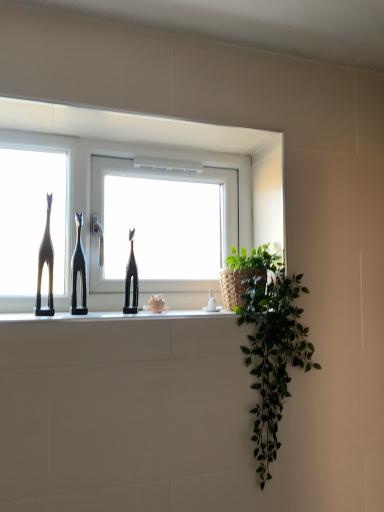
Question: From the image's perspective, is white glossy window at center located above or below black glossy giraffe at center, which appears as the 2th sculpture when viewed from the left?

Choices:
 (A) below
 (B) above

Answer: (B)

Question: From a real-world perspective, is white glossy window at center physically located above or below black glossy giraffe at center, marked as the first sculpture in a right-to-left arrangement?

Choices:
 (A) above
 (B) below

Answer: (A)

Question: Which object is positioned farthest from the white glossy window at center?

Choices:
 (A) black matte cat at center, placed as the 2th sculpture when sorted from right to left
 (B) matte black giraffe at left
 (C) black glossy giraffe at center, marked as the first sculpture in a right-to-left arrangement

Answer: (B)

Question: Estimate the real-world distances between objects in this image. Which object is closer to the black glossy giraffe at center, marked as the first sculpture in a right-to-left arrangement?

Choices:
 (A) black matte cat at center, positioned as the 1th sculpture in left-to-right order
 (B) matte black giraffe at left
 (C) white glossy window at center

Answer: (A)